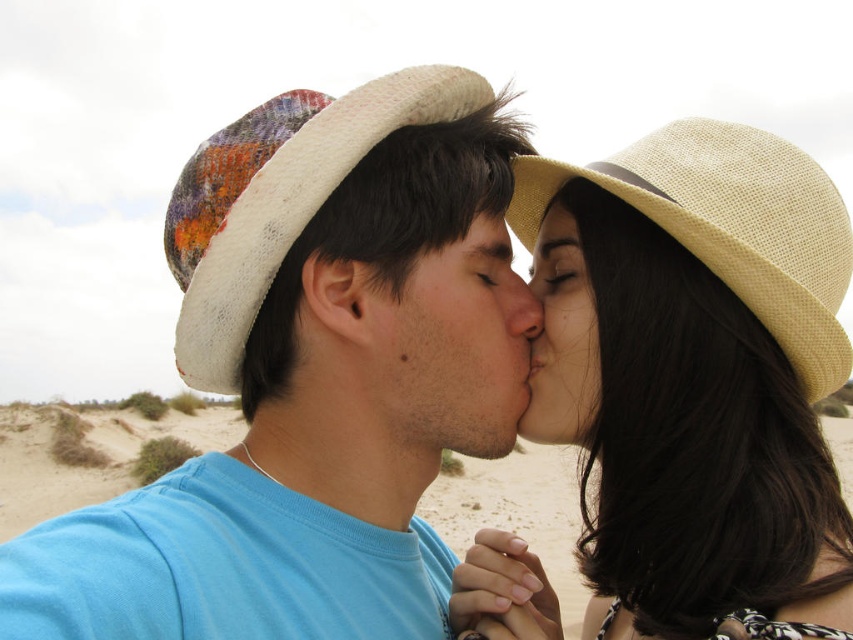
Question: Considering the real-world distances, which object is farthest from the beige straw hat at upper right?

Choices:
 (A) white woven cowboy hat at center
 (B) smooth skin face at center

Answer: (A)

Question: Is matte white hat at center bigger than smooth skin face at center?

Choices:
 (A) no
 (B) yes

Answer: (B)

Question: Is beige straw hat at upper right closer to the viewer compared to matte beige hat at upper center?

Choices:
 (A) no
 (B) yes

Answer: (B)

Question: Which is farther from the smooth skin face at center?

Choices:
 (A) smooth skin nose at center
 (B) matte beige hat at upper center
 (C) matte white hat at center
 (D) beige straw hat at upper right

Answer: (D)

Question: Which object is farther from the camera taking this photo?

Choices:
 (A) smooth skin nose at center
 (B) white woven cowboy hat at center

Answer: (A)

Question: Is smooth skin face at center thinner than matte beige hat at center?

Choices:
 (A) no
 (B) yes

Answer: (A)